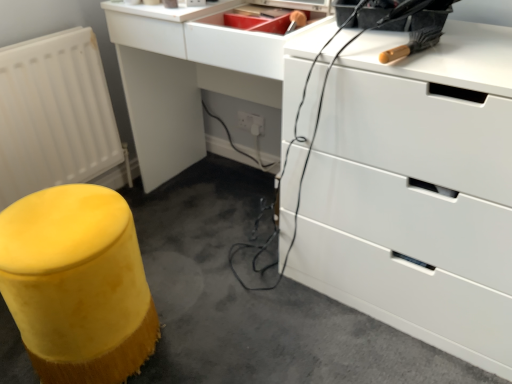
Question: In terms of height, does yellow fabric stool at lower left look taller or shorter compared to white matte radiator at lower left?

Choices:
 (A) short
 (B) tall

Answer: (A)

Question: Is yellow fabric stool at lower left to the left or to the right of white matte radiator at lower left in the image?

Choices:
 (A) left
 (B) right

Answer: (B)

Question: Which object is the closest to the white matte radiator at lower left?

Choices:
 (A) yellow fabric stool at lower left
 (B) yellow fuzzy stool at lower left
 (C) white glossy chest of drawers at upper right

Answer: (A)

Question: Which object is the closest to the yellow fuzzy stool at lower left?

Choices:
 (A) yellow fabric stool at lower left
 (B) white matte radiator at lower left
 (C) white glossy chest of drawers at upper right

Answer: (A)